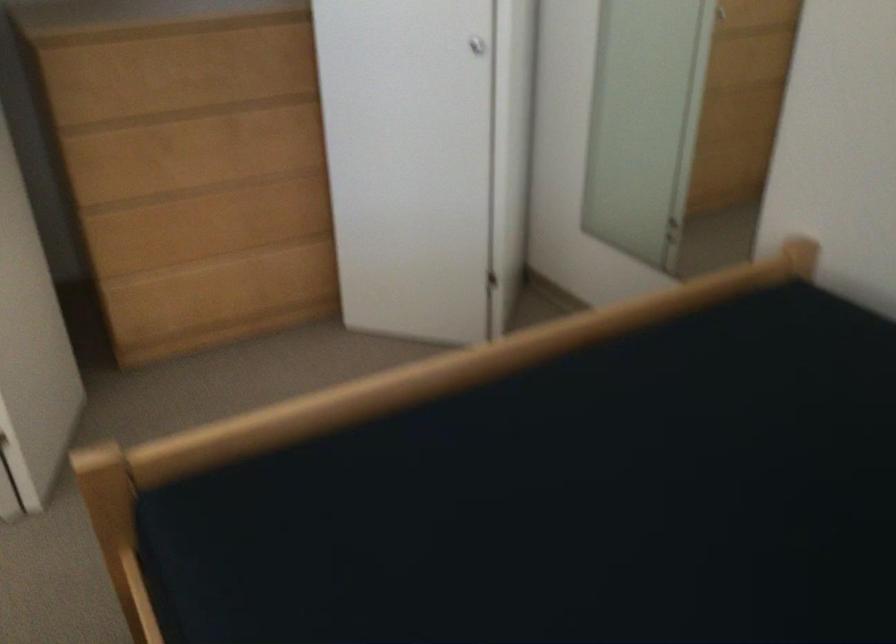
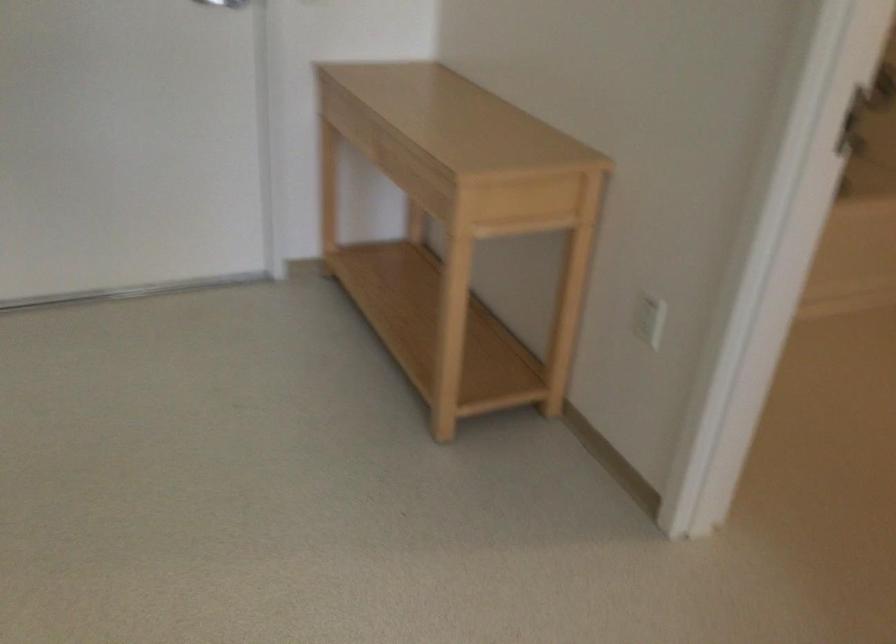
In a continuous first-person perspective shot, in which direction is the camera moving?

The movement direction of the cameraman is left, forward.